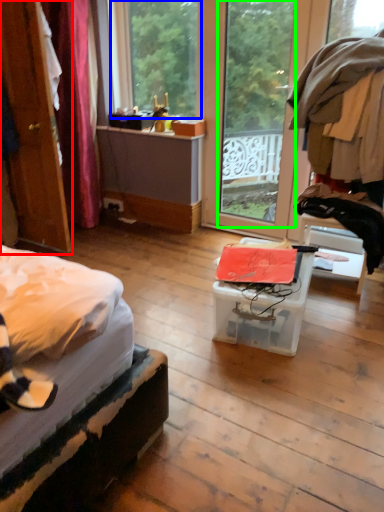
Question: Estimate the real-world distances between objects in this image. Which object is closer to door (highlighted by a red box), window (highlighted by a blue box) or glass door (highlighted by a green box)?

Choices:
 (A) window
 (B) glass door

Answer: (A)